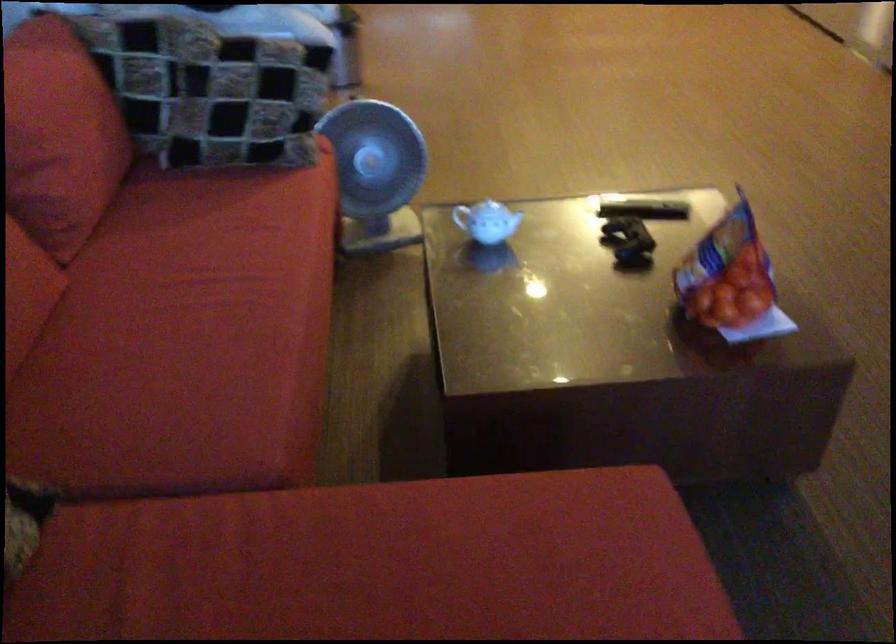
The height and width of the screenshot is (644, 896). I want to click on white teapot handle, so click(487, 220).